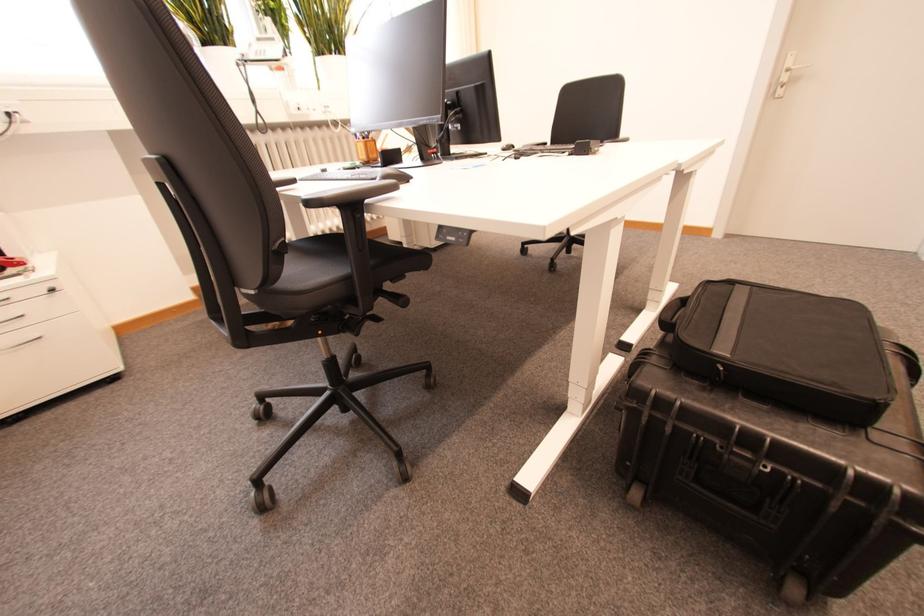
Describe the element at coordinates (726, 374) in the screenshot. I see `the black case latch` at that location.